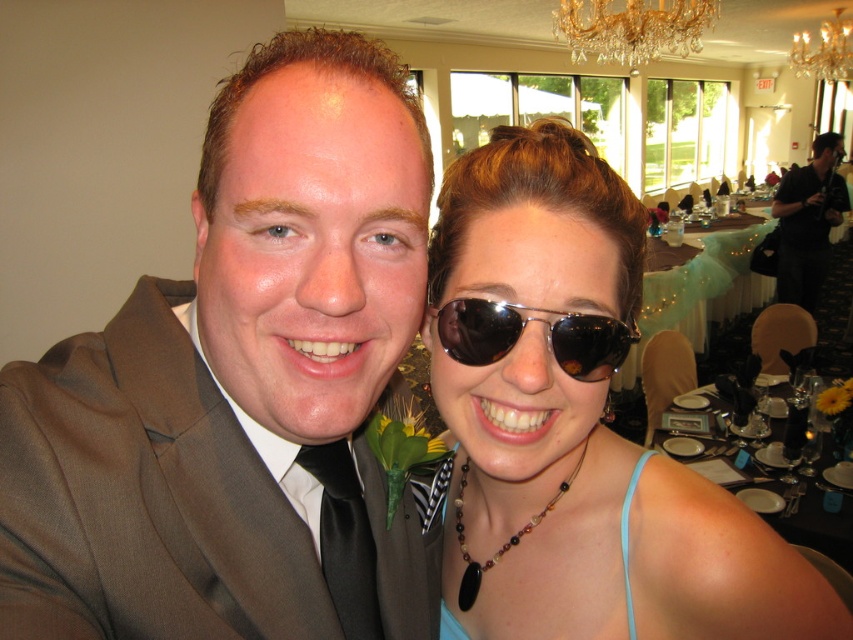
Question: Can you confirm if matte black sunglasses at upper right is bigger than gold crystal chandelier at upper center?

Choices:
 (A) yes
 (B) no

Answer: (B)

Question: Which point is closer to the camera?

Choices:
 (A) (579, 0)
 (B) (334, 456)
 (C) (747, 465)
 (D) (808, 243)

Answer: (B)

Question: Considering the relative positions of black glassware at right and black leather jacket at upper right in the image provided, where is black glassware at right located with respect to black leather jacket at upper right?

Choices:
 (A) above
 (B) below

Answer: (B)

Question: Which point is closer to the camera?

Choices:
 (A) (476, 328)
 (B) (809, 173)
 (C) (442, 339)

Answer: (A)

Question: Which of the following is the closest to the observer?

Choices:
 (A) black satin tie at center
 (B) gold crystal chandelier at upper center
 (C) black leather jacket at upper right

Answer: (A)

Question: Is gold crystal chandelier at upper center above black leather jacket at upper right?

Choices:
 (A) no
 (B) yes

Answer: (B)